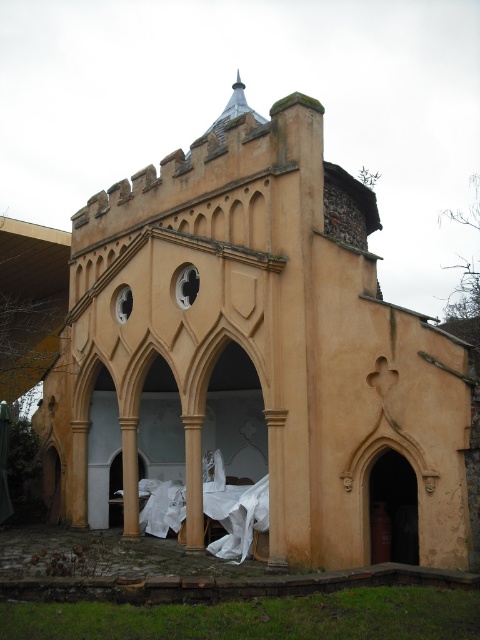
You are an architect designing a new Gothic structure and want to place a decorative element between the smooth stone column at center and the beige stone column at center. Given that the space between them is 22.37 feet, can you fit a 20 feet long decorative element horizontally between them?

The smooth stone column at center and beige stone column at center are 22.37 feet apart, so yes, a 20 feet long decorative element can fit horizontally between them since it is shorter than the available space.

You are standing at point A located at coordinates point A at (x=282, y=502). You want to walk to point B which is 42.88 meters away. Considering the building in the scene, will you have to go around it or can you walk straight?

The distance between point A at (x=282, y=502) and point B is 42.88 meters. Since the building is small and ornate with a Gothic design, it is likely not large enough to block a straight path between the two points. Therefore, you can walk straight without needing to go around the building.

You are standing in front of the Gothic structure and notice two columns. The smooth stone column at center and the beige stone column at center. Which one is positioned to the right of the other?

The smooth stone column at center is positioned to the right of the beige stone column at center.